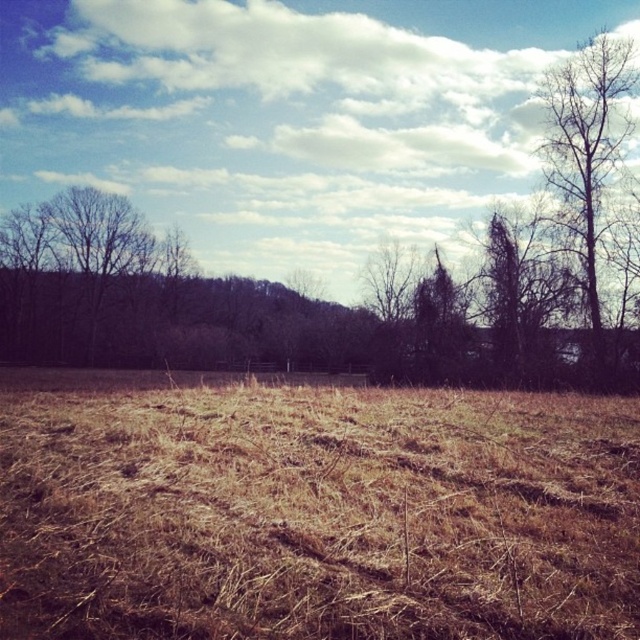
Is brown dry grass at center bigger than bare branches at right?

No.

Who is more distant from viewer, (550, 468) or (593, 358)?

The point (593, 358) is more distant.

Which is behind, point (627, 561) or point (614, 45)?

Positioned behind is point (614, 45).

In order to click on brown dry grass at center in this screenshot , I will do `click(312, 509)`.